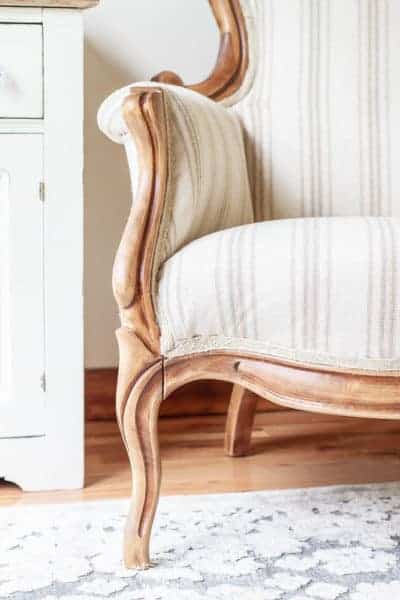
The width and height of the screenshot is (400, 600). I want to click on white wall, so click(147, 50).